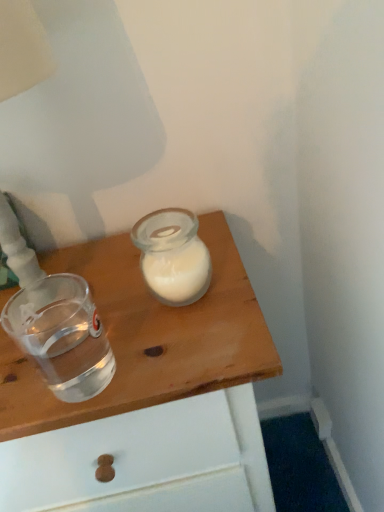
Image resolution: width=384 pixels, height=512 pixels. In order to click on free spot above transparent glass at upper center (from a real-world perspective) in this screenshot , I will do `click(108, 311)`.